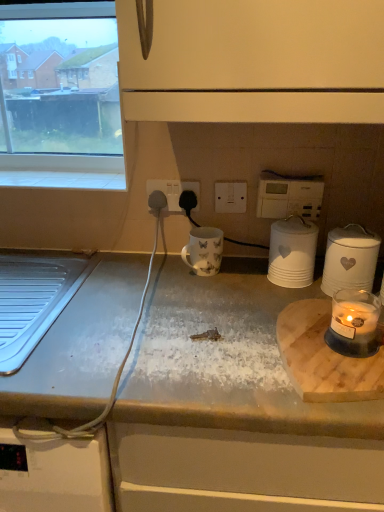
What is the approximate height of white matte canister at center-right, the first kitchen appliance when ordered from left to right?

white matte canister at center-right, the first kitchen appliance when ordered from left to right, is 6.04 inches in height.

The image size is (384, 512). Describe the element at coordinates (289, 197) in the screenshot. I see `white plastic thermostat at upper right` at that location.

Describe the element at coordinates (350, 259) in the screenshot. This screenshot has width=384, height=512. I see `white ceramic jar at right, which ranks as the first kitchen appliance in right-to-left order` at that location.

At what (x,y) coordinates should I click in order to perform the action: click on translucent glass candle at right. Please return your answer as a coordinate pair (x, y). Looking at the image, I should click on (354, 323).

Locate an element on the screen. white plastic switch at center, placed as the 1th electric outlet when sorted from right to left is located at coordinates (230, 197).

From the image's perspective, between white matte canister at center-right, placed as the second kitchen appliance when sorted from right to left, and translucent glass candle at right, which one is located above?

From the image's view, white matte canister at center-right, placed as the second kitchen appliance when sorted from right to left, is above.

From a real-world perspective, is white matte canister at center-right, the first kitchen appliance when ordered from left to right, physically located above or below translucent glass candle at right?

From a real-world perspective, white matte canister at center-right, the first kitchen appliance when ordered from left to right, is physically above translucent glass candle at right.

Is white matte canister at center-right, the first kitchen appliance when ordered from left to right, in front of translucent glass candle at right?

No, it is not.

Is white ceramic jar at right, which ranks as the first kitchen appliance in right-to-left order, oriented away from white glossy mug at center?

No.

How much distance is there between white ceramic jar at right, which ranks as the second kitchen appliance in left-to-right order, and white glossy mug at center?

The distance of white ceramic jar at right, which ranks as the second kitchen appliance in left-to-right order, from white glossy mug at center is 30.05 centimeters.

Which is in front, white ceramic jar at right, which ranks as the second kitchen appliance in left-to-right order, or white glossy mug at center?

white ceramic jar at right, which ranks as the second kitchen appliance in left-to-right order, is closer to the camera.

Is white ceramic jar at right, which ranks as the second kitchen appliance in left-to-right order, spatially inside white glossy mug at center, or outside of it?

white ceramic jar at right, which ranks as the second kitchen appliance in left-to-right order, is not inside white glossy mug at center, it's outside.

Does white plastic socket at center, the first electric outlet when ordered from left to right, have a smaller size compared to white plastic thermostat at upper right?

Indeed, white plastic socket at center, the first electric outlet when ordered from left to right, has a smaller size compared to white plastic thermostat at upper right.

Does white plastic socket at center, marked as the 2th electric outlet in a right-to-left arrangement, contain white plastic thermostat at upper right?

Definitely not — white plastic thermostat at upper right is not inside white plastic socket at center, marked as the 2th electric outlet in a right-to-left arrangement.

Does white plastic socket at center, the first electric outlet when ordered from left to right, have a greater width compared to white plastic thermostat at upper right?

In fact, white plastic socket at center, the first electric outlet when ordered from left to right, might be narrower than white plastic thermostat at upper right.

Does point (174, 196) lie in front of point (305, 200)?

No, it is behind (305, 200).

In terms of width, does white glossy mug at center look wider or thinner when compared to white marble countertop at center?

In the image, white glossy mug at center appears to be more narrow than white marble countertop at center.

Does white glossy mug at center touch white marble countertop at center?

white glossy mug at center is not next to white marble countertop at center, and they're not touching.

Can you tell me how much white glossy mug at center and white marble countertop at center differ in facing direction?

They differ by 0.397 degrees in their facing directions.

In order to click on countertop below the white glossy mug at center (from a real-world perspective) in this screenshot , I will do `click(232, 407)`.

Looking at this image, is white ceramic jar at right, which ranks as the second kitchen appliance in left-to-right order, behind translucent glass candle at right?

Yes, the depth of white ceramic jar at right, which ranks as the second kitchen appliance in left-to-right order, is greater than that of translucent glass candle at right.

From a real-world perspective, relative to translucent glass candle at right, is white ceramic jar at right, which ranks as the first kitchen appliance in right-to-left order, vertically above or below?

In terms of real-world spatial position, white ceramic jar at right, which ranks as the first kitchen appliance in right-to-left order, is above translucent glass candle at right.

Considering the positions of objects white ceramic jar at right, which ranks as the second kitchen appliance in left-to-right order, and translucent glass candle at right in the image provided, who is more to the right, white ceramic jar at right, which ranks as the second kitchen appliance in left-to-right order, or translucent glass candle at right?

From the viewer's perspective, white ceramic jar at right, which ranks as the second kitchen appliance in left-to-right order, appears more on the right side.

Is point (373, 272) closer or farther from the camera than point (376, 321)?

Point (373, 272) is farther from the camera than point (376, 321).

In the image, is white ceramic jar at right, which ranks as the first kitchen appliance in right-to-left order, positioned in front of or behind white marble countertop at center?

white ceramic jar at right, which ranks as the first kitchen appliance in right-to-left order, is positioned farther from the viewer than white marble countertop at center.

Looking at this image, from the image's perspective, is white ceramic jar at right, which ranks as the second kitchen appliance in left-to-right order, positioned above or below white marble countertop at center?

white ceramic jar at right, which ranks as the second kitchen appliance in left-to-right order, is situated higher than white marble countertop at center in the image.

In the scene shown: Is white ceramic jar at right, which ranks as the second kitchen appliance in left-to-right order, positioned beyond the bounds of white marble countertop at center?

Indeed, white ceramic jar at right, which ranks as the second kitchen appliance in left-to-right order, is completely outside white marble countertop at center.

From a real-world perspective, is white plastic thermostat at upper right positioned above or below white glossy mug at center?

Clearly, from a real-world perspective, white plastic thermostat at upper right is above white glossy mug at center.

From the image's perspective, is white plastic thermostat at upper right on white glossy mug at center?

Correct, white plastic thermostat at upper right appears higher than white glossy mug at center in the image.

Is point (302, 180) closer or farther from the camera than point (198, 255)?

Clearly, point (302, 180) is more distant from the camera than point (198, 255).

Does white plastic thermostat at upper right have a lesser height compared to white glossy mug at center?

No.

Identify the location of candle holder that appears in front of the white matte canister at center-right, the first kitchen appliance when ordered from left to right. The height and width of the screenshot is (512, 384). (354, 323).

Locate an element on the screen. This screenshot has height=512, width=384. kitchen appliance below the white glossy mug at center (from the image's perspective) is located at coordinates (350, 259).

Which object lies further to the anchor point white tile at upper left, white plastic thermostat at upper right or white plastic switch at center, placed as the 1th electric outlet when sorted from right to left?

white plastic thermostat at upper right is further to white tile at upper left.

From the image, which object appears to be nearer to white plastic switch at center, placed as the 1th electric outlet when sorted from right to left, white plastic thermostat at upper right or white marble countertop at center?

white plastic thermostat at upper right is closer to white plastic switch at center, placed as the 1th electric outlet when sorted from right to left.

Based on their spatial positions, is translucent glass candle at right or white ceramic jar at right, which ranks as the first kitchen appliance in right-to-left order, closer to white matte canister at center-right, the first kitchen appliance when ordered from left to right?

Among the two, white ceramic jar at right, which ranks as the first kitchen appliance in right-to-left order, is located nearer to white matte canister at center-right, the first kitchen appliance when ordered from left to right.

From the image, which object appears to be farther from white plastic switch at center, which appears as the second electric outlet when viewed from the left, white tile at upper left or white ceramic jar at right, which ranks as the second kitchen appliance in left-to-right order?

Based on the image, white tile at upper left appears to be further to white plastic switch at center, which appears as the second electric outlet when viewed from the left.

Estimate the real-world distances between objects in this image. Which object is closer to white plastic switch at center, placed as the 1th electric outlet when sorted from right to left, translucent glass candle at right or white tile at upper left?

Among the two, translucent glass candle at right is located nearer to white plastic switch at center, placed as the 1th electric outlet when sorted from right to left.

When comparing their distances from white plastic thermostat at upper right, does white ceramic jar at right, which ranks as the second kitchen appliance in left-to-right order, or white matte canister at center-right, the first kitchen appliance when ordered from left to right, seem closer?

white matte canister at center-right, the first kitchen appliance when ordered from left to right, is closer to white plastic thermostat at upper right.

Considering their positions, is white ceramic jar at right, which ranks as the second kitchen appliance in left-to-right order, positioned further to white plastic thermostat at upper right than white plastic socket at center, marked as the 2th electric outlet in a right-to-left arrangement?

white plastic socket at center, marked as the 2th electric outlet in a right-to-left arrangement, is positioned further to the anchor white plastic thermostat at upper right.

Considering their positions, is translucent glass candle at right positioned further to white plastic socket at center, marked as the 2th electric outlet in a right-to-left arrangement, than white tile at upper left?

translucent glass candle at right.

You are a GUI agent. You are given a task and a screenshot of the screen. Output one action in this format:
    pyautogui.click(x=<x>, y=<y>)
    Task: Click on the mug that lies between white tile at upper left and white marble countertop at center from top to bottom
    
    Given the screenshot: What is the action you would take?
    pyautogui.click(x=204, y=251)

I want to click on appliance between white tile at upper left and white ceramic jar at right, which ranks as the first kitchen appliance in right-to-left order, in the horizontal direction, so click(x=289, y=197).

Where is `candle holder between white glossy mug at center and white ceramic jar at right, which ranks as the first kitchen appliance in right-to-left order, from left to right`? The height and width of the screenshot is (512, 384). candle holder between white glossy mug at center and white ceramic jar at right, which ranks as the first kitchen appliance in right-to-left order, from left to right is located at coordinates (354, 323).

Locate an element on the screen. mug that lies between white plastic thermostat at upper right and white marble countertop at center from top to bottom is located at coordinates (204, 251).